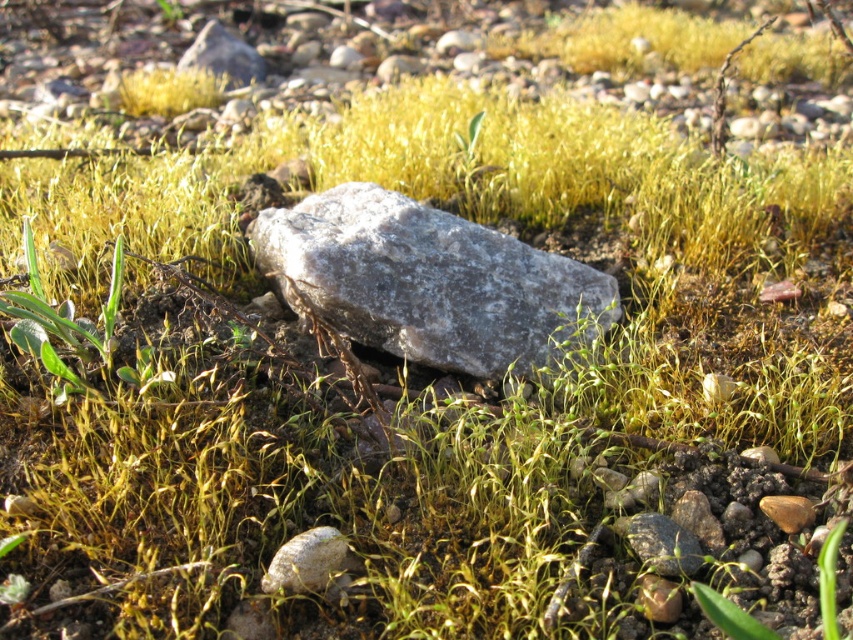
Question: Does smooth gray rock at lower center have a lesser width compared to gray rock at upper center?

Choices:
 (A) yes
 (B) no

Answer: (A)

Question: Which object appears farthest from the camera in this image?

Choices:
 (A) gray rock at upper center
 (B) gray stone at center
 (C) smooth gray rock at lower center

Answer: (A)

Question: Is smooth gray rock at lower center to the right of gray rock at upper center from the viewer's perspective?

Choices:
 (A) no
 (B) yes

Answer: (B)

Question: Estimate the real-world distances between objects in this image. Which object is farther from the gray stone at center?

Choices:
 (A) gray rock at upper center
 (B) smooth gray rock at lower center

Answer: (A)

Question: Which point is farther to the camera?

Choices:
 (A) smooth gray rock at lower center
 (B) gray stone at center
 (C) gray rock at upper center

Answer: (C)

Question: Does gray stone at center appear on the left side of gray rock at upper center?

Choices:
 (A) no
 (B) yes

Answer: (A)